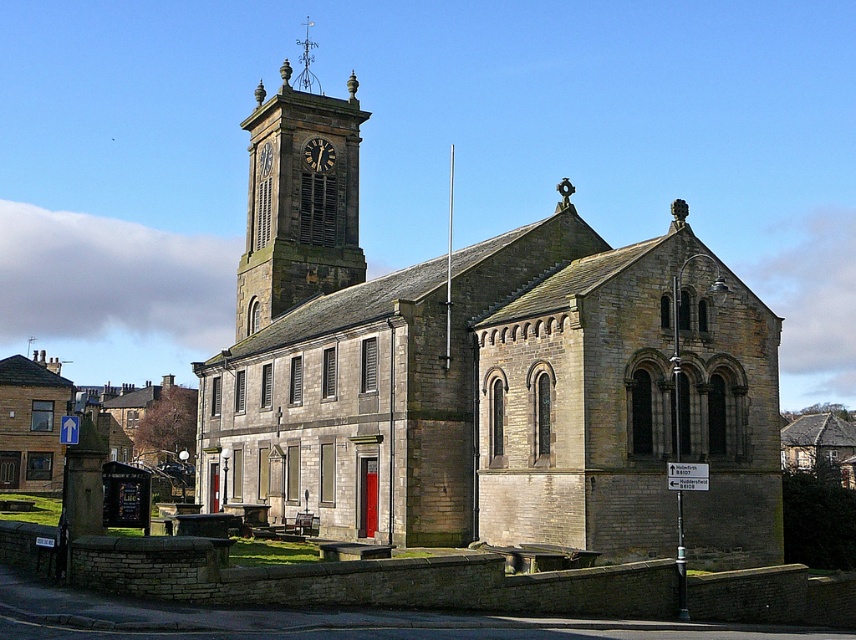
Between stone church at center and stone clock tower at upper left, which one is positioned higher?

stone clock tower at upper left is higher up.

Is point (773, 324) farther from camera compared to point (312, 227)?

That is False.

Does point (699, 321) lie behind point (280, 304)?

No, it is not.

This screenshot has height=640, width=856. Identify the location of stone church at center. click(485, 376).

Between stone clock tower at upper left and matte stone clock at upper center, which one has more height?

Standing taller between the two is stone clock tower at upper left.

Who is more forward, (331, 262) or (263, 173)?

Positioned in front is point (331, 262).

What are the coordinates of `stone clock tower at upper left` in the screenshot? It's located at (299, 204).

Can you confirm if stone church at center is thinner than matte stone clock at upper center?

Incorrect, stone church at center's width is not less than matte stone clock at upper center's.

In order to click on stone church at center in this screenshot , I will do `click(485, 376)`.

Locate an element on the screen. The height and width of the screenshot is (640, 856). stone church at center is located at coordinates (485, 376).